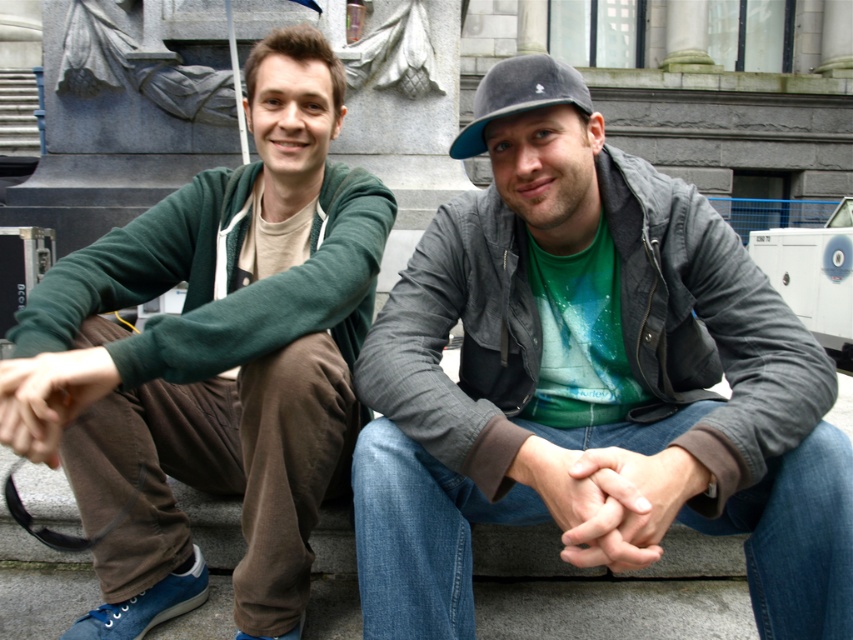
Question: Which object is the farthest from the matte gray jacket at center?

Choices:
 (A) smooth skin hands at center
 (B) brown suede handbag at lower left
 (C) matte green hoodie at center
 (D) gray felt baseball cap at center

Answer: (B)

Question: Is matte gray jacket at center further to camera compared to gray felt baseball cap at center?

Choices:
 (A) no
 (B) yes

Answer: (A)

Question: Among these points, which one is farthest from the camera?

Choices:
 (A) (525, 308)
 (B) (540, 60)
 (C) (252, 410)

Answer: (A)

Question: Considering the real-world distances, which object is closest to the smooth skin hands at center?

Choices:
 (A) matte gray jacket at center
 (B) matte green hoodie at center
 (C) brown suede handbag at lower left

Answer: (A)

Question: Observing the image, what is the correct spatial positioning of matte gray jacket at center in reference to brown suede handbag at lower left?

Choices:
 (A) above
 (B) below

Answer: (A)

Question: In this image, where is matte green hoodie at center located relative to gray felt baseball cap at center?

Choices:
 (A) above
 (B) below

Answer: (B)